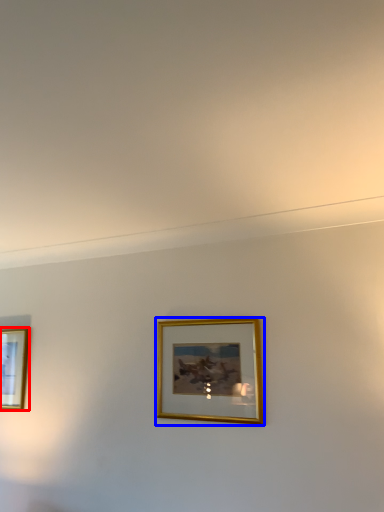
Question: Which of the following is the farthest to the observer, picture frame (highlighted by a red box) or picture frame (highlighted by a blue box)?

Choices:
 (A) picture frame
 (B) picture frame

Answer: (A)